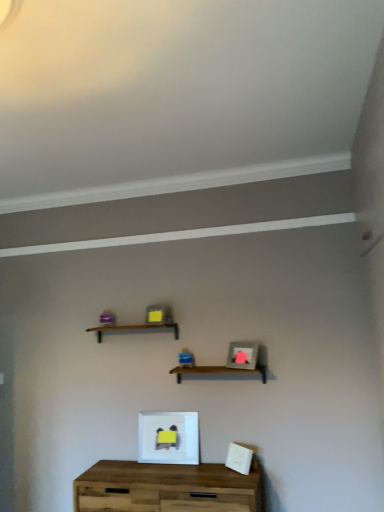
Find the location of a particular element. The height and width of the screenshot is (512, 384). vacant area on top of wooden table at center (from a real-world perspective) is located at coordinates (178, 466).